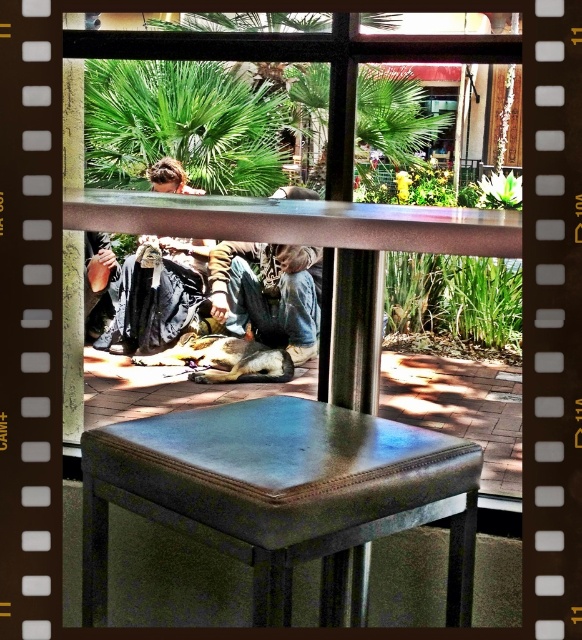
Question: Which object is positioned closest to the leather-like stool at center?

Choices:
 (A) denim jeans at center
 (B) green leafy palm tree at upper center

Answer: (A)

Question: Is leather-like stool at center closer to the viewer compared to dark gray fabric at lower left?

Choices:
 (A) no
 (B) yes

Answer: (B)

Question: Which object is the farthest from the green leafy palm tree at upper center?

Choices:
 (A) denim jeans at center
 (B) leather-like stool at center

Answer: (B)

Question: Which object is the closest to the denim jeans at center?

Choices:
 (A) leather-like stool at center
 (B) green leafy palm tree at upper center
 (C) dark gray fabric at lower left

Answer: (C)

Question: Is denim jeans at center bigger than dark gray fabric at lower left?

Choices:
 (A) yes
 (B) no

Answer: (A)

Question: Can you confirm if leather-like stool at center is smaller than dark gray fabric at lower left?

Choices:
 (A) yes
 (B) no

Answer: (A)